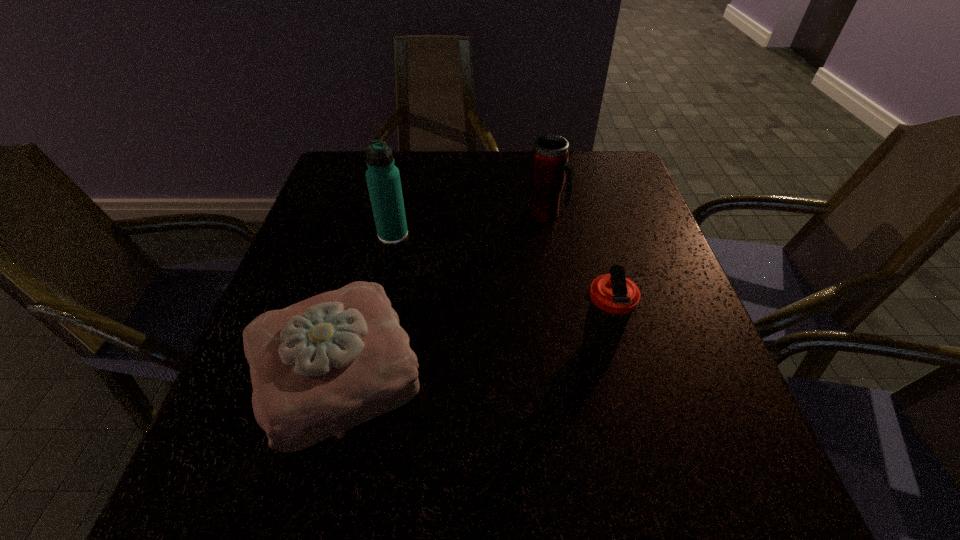
In order to click on the tallest object in this screenshot , I will do `click(383, 179)`.

Where is `the tallest thermos bottle`? the tallest thermos bottle is located at coordinates (383, 179).

You are a GUI agent. You are given a task and a screenshot of the screen. Output one action in this format:
    pyautogui.click(x=<x>, y=<y>)
    Task: Click on the nearest thermos bottle
    
    Given the screenshot: What is the action you would take?
    [x=612, y=297]

Locate an element on the screen. This screenshot has width=960, height=540. cake is located at coordinates (322, 366).

You are a GUI agent. You are given a task and a screenshot of the screen. Output one action in this format:
    pyautogui.click(x=<x>, y=<y>)
    Task: Click on the vacant space positioned 0.150m on the back of the tallest thermos bottle
    This screenshot has height=540, width=960.
    Given the screenshot: What is the action you would take?
    pyautogui.click(x=403, y=191)

Find the location of `vacant space located 0.110m on the left of the nearest thermos bottle`. vacant space located 0.110m on the left of the nearest thermos bottle is located at coordinates (511, 352).

Identify the location of vacant position located on the right of the cake. (565, 370).

Identify the location of object located at the left edge. The height and width of the screenshot is (540, 960). (322, 366).

Locate an element on the screen. The height and width of the screenshot is (540, 960). vacant space at the far edge of the desktop is located at coordinates (453, 165).

Locate an element on the screen. Image resolution: width=960 pixels, height=540 pixels. vacant space at the near edge of the desktop is located at coordinates (522, 494).